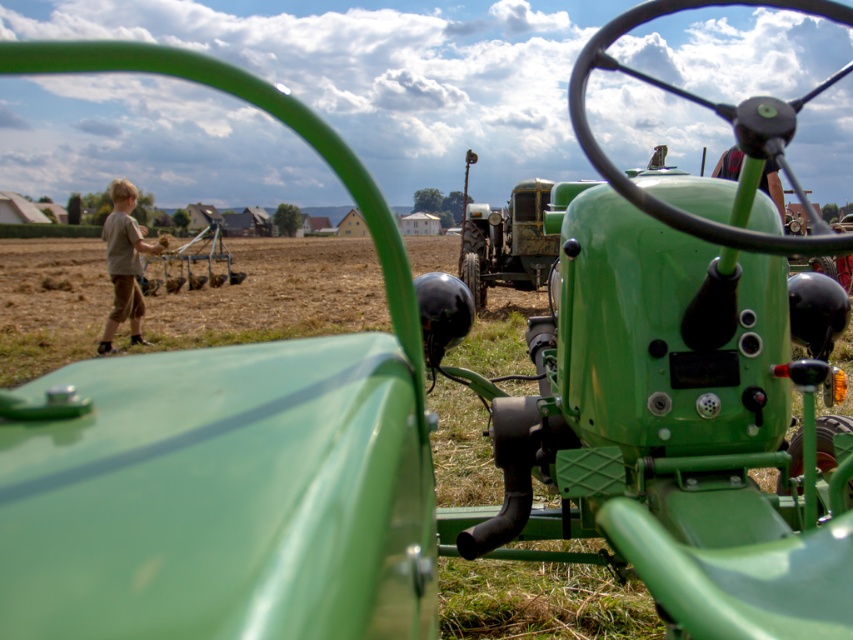
Is green matte tractor at center above brown cotton shirt at left?

Correct, green matte tractor at center is located above brown cotton shirt at left.

The height and width of the screenshot is (640, 853). Describe the element at coordinates (506, 241) in the screenshot. I see `green matte tractor at center` at that location.

Locate an element on the screen. This screenshot has height=640, width=853. green matte tractor at center is located at coordinates (506, 241).